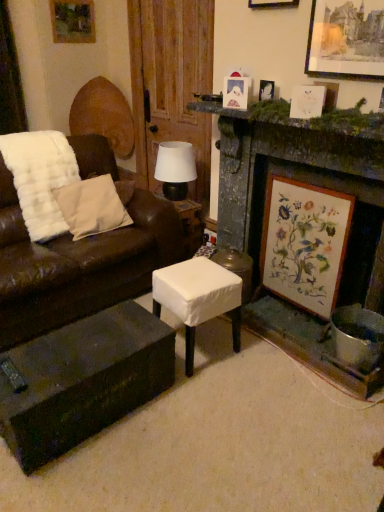
Question: Can you see wooden picture frame at upper left, which is the sixth picture frame in bottom-to-top order, touching beige cotton pillow at left?

Choices:
 (A) yes
 (B) no

Answer: (B)

Question: Does wooden picture frame at upper left, placed as the 1th picture frame when sorted from top to bottom, appear on the left side of beige cotton pillow at left?

Choices:
 (A) no
 (B) yes

Answer: (B)

Question: From a real-world perspective, is wooden picture frame at upper left, placed as the 1th picture frame when sorted from top to bottom, physically below beige cotton pillow at left?

Choices:
 (A) no
 (B) yes

Answer: (A)

Question: From the image's perspective, is wooden picture frame at upper left, arranged as the 6th picture frame when viewed from the front, over beige cotton pillow at left?

Choices:
 (A) yes
 (B) no

Answer: (A)

Question: Is wooden picture frame at upper left, which is the sixth picture frame in bottom-to-top order, wider than beige cotton pillow at left?

Choices:
 (A) no
 (B) yes

Answer: (A)

Question: Considering the positions of wooden picture frame at upper center, marked as the 4th picture frame in a right-to-left arrangement, and white fabric stool at center in the image, is wooden picture frame at upper center, marked as the 4th picture frame in a right-to-left arrangement, taller or shorter than white fabric stool at center?

Choices:
 (A) short
 (B) tall

Answer: (B)

Question: Is wooden picture frame at upper center, the 3th picture frame in the left-to-right sequence, wider or thinner than white fabric stool at center?

Choices:
 (A) thin
 (B) wide

Answer: (A)

Question: In the image, is wooden picture frame at upper center, the third picture frame when ordered from front to back, on the left side or the right side of white fabric stool at center?

Choices:
 (A) left
 (B) right

Answer: (B)

Question: From a real-world perspective, relative to white fabric stool at center, is wooden picture frame at upper center, the 3th picture frame in the left-to-right sequence, vertically above or below?

Choices:
 (A) above
 (B) below

Answer: (A)

Question: Looking at their shapes, would you say brown leather couch at left is wider or thinner than stone fireplace at center right?

Choices:
 (A) wide
 (B) thin

Answer: (A)

Question: Is brown leather couch at left to the left or to the right of stone fireplace at center right in the image?

Choices:
 (A) right
 (B) left

Answer: (B)

Question: Does point coord(3,337) appear closer or farther from the camera than point coord(241,121)?

Choices:
 (A) farther
 (B) closer

Answer: (B)

Question: Do you think brown leather couch at left is within stone fireplace at center right, or outside of it?

Choices:
 (A) inside
 (B) outside

Answer: (B)

Question: Considering the positions of white fabric stool at center and white paper picture frame at upper right, the third picture frame from the right, in the image, is white fabric stool at center bigger or smaller than white paper picture frame at upper right, the third picture frame from the right,?

Choices:
 (A) small
 (B) big

Answer: (B)

Question: From a real-world perspective, is white fabric stool at center above or below white paper picture frame at upper right, which is counted as the fifth picture frame, starting from the back?

Choices:
 (A) below
 (B) above

Answer: (A)